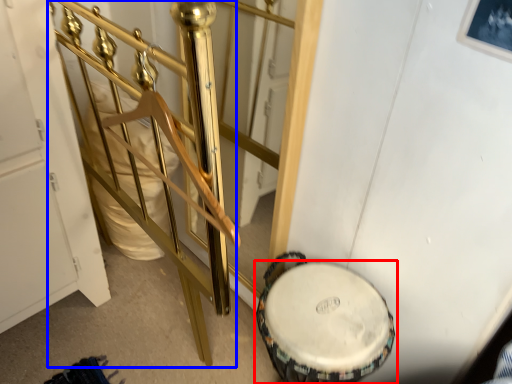
Question: Which object appears farthest to the camera in this image, drum (highlighted by a red box) or rail (highlighted by a blue box)?

Choices:
 (A) drum
 (B) rail

Answer: (A)